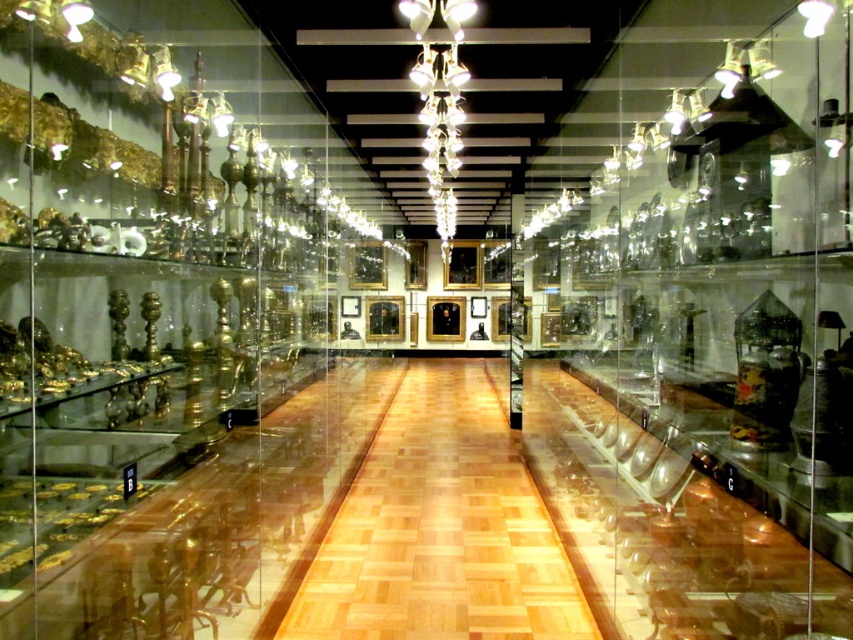
Does clear glass display case at center have a larger size compared to white glass chandelier at center?

Correct, clear glass display case at center is larger in size than white glass chandelier at center.

Does clear glass display case at center have a greater height compared to white glass chandelier at center?

Yes.

Which is behind, point (798, 380) or point (422, 109)?

The point (422, 109) is behind.

Find the location of a particular element. The image size is (853, 640). clear glass display case at center is located at coordinates (706, 330).